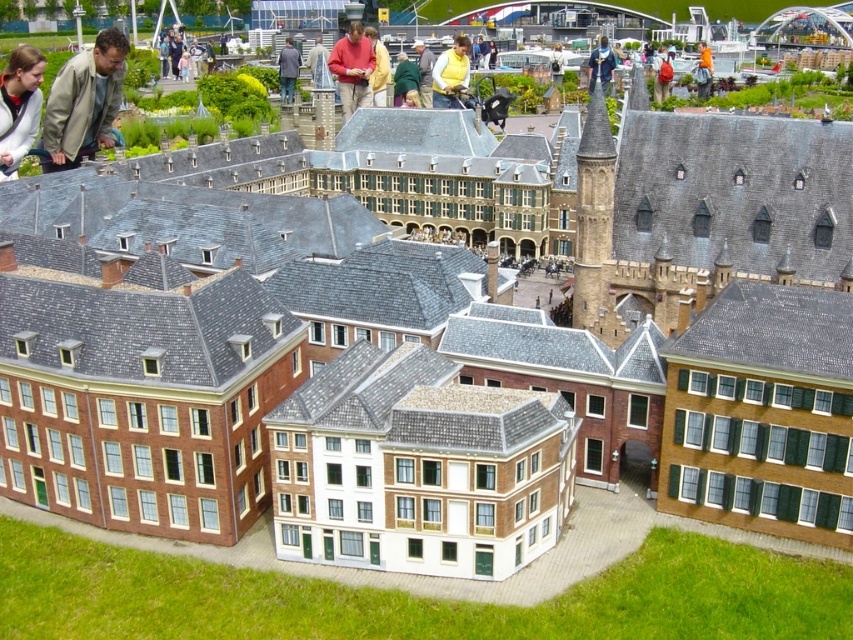
Question: Among these objects, which one is farthest from the camera?

Choices:
 (A) light brown leather jacket at upper left
 (B) blue denim jacket at upper center
 (C) green wool sweater at center

Answer: (B)

Question: Is matte red shirt at center to the left of gray fabric jacket at upper center from the viewer's perspective?

Choices:
 (A) yes
 (B) no

Answer: (B)

Question: Which object is farther from the camera taking this photo?

Choices:
 (A) gray fabric jacket at upper center
 (B) matte red shirt at center

Answer: (A)

Question: Where is green wool sweater at center located in relation to matte gray coat at center in the image?

Choices:
 (A) left
 (B) right

Answer: (B)

Question: Which object is positioned farthest from the matte gray coat at center?

Choices:
 (A) light brown leather jacket at upper left
 (B) orange backpack at center
 (C) matte black jacket at upper left
 (D) green fabric jacket at center

Answer: (C)

Question: Is light brown leather jacket at upper left positioned in front of yellow matte jacket at center?

Choices:
 (A) yes
 (B) no

Answer: (A)